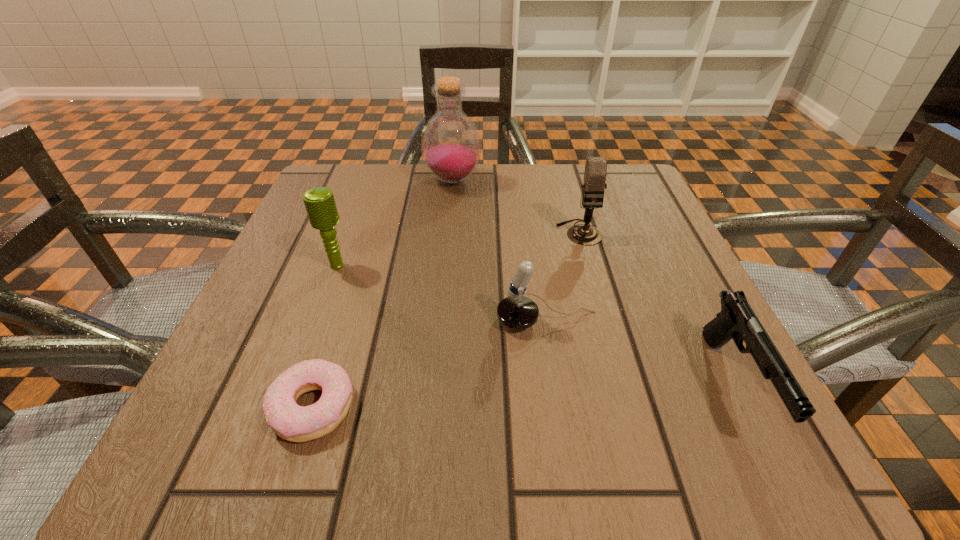
The width and height of the screenshot is (960, 540). What are the coordinates of `vacant point located between the third farthest object and the rightmost object` in the screenshot? It's located at (536, 325).

Find the location of a particular element. vacant area that lies between the farthest microphone and the shortest object is located at coordinates (446, 320).

Where is `object that is the second closest to the second farthest object`? object that is the second closest to the second farthest object is located at coordinates (451, 146).

This screenshot has height=540, width=960. In order to click on object that is the third closest to the tallest object in this screenshot , I will do `click(518, 312)`.

You are a GUI agent. You are given a task and a screenshot of the screen. Output one action in this format:
    pyautogui.click(x=<x>, y=<y>)
    Task: Click on the microphone that is the closest to the fourth object from right to left
    Image resolution: width=960 pixels, height=540 pixels.
    Given the screenshot: What is the action you would take?
    pyautogui.click(x=595, y=172)

Identify the location of the second closest microphone to the second farthest object. Image resolution: width=960 pixels, height=540 pixels. (319, 202).